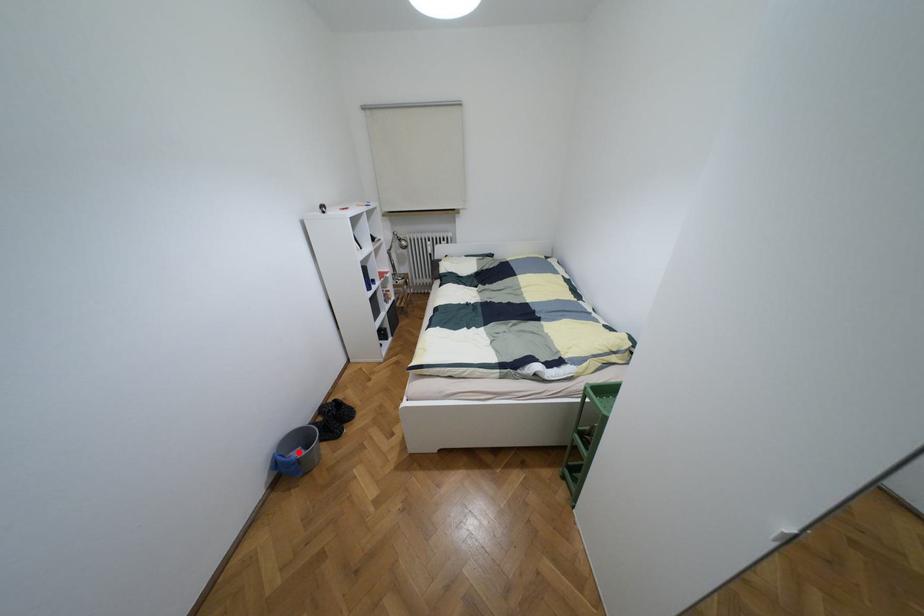
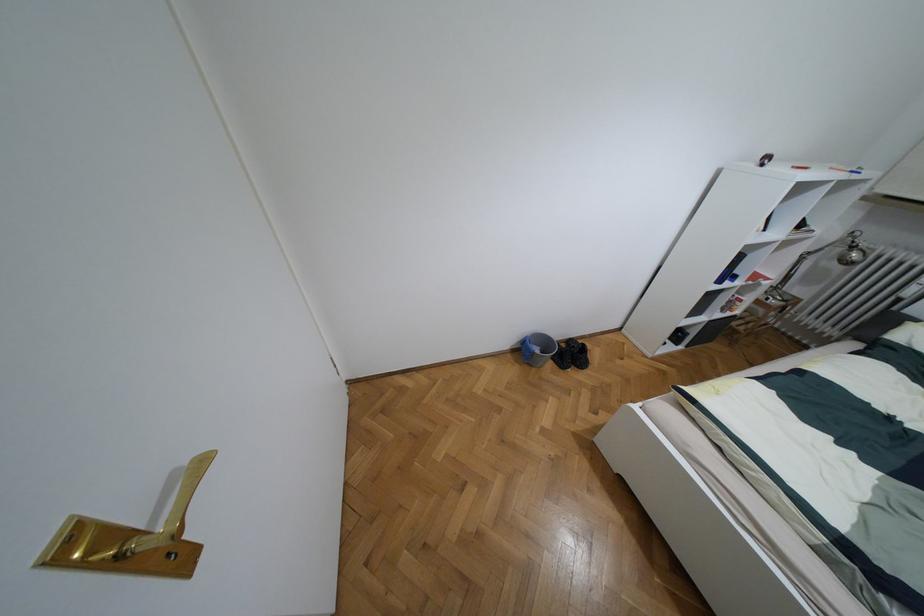
Question: I am providing you with two images of the same scene from different viewpoints. Given a red point in image1, look at the same physical point in image2. Is it:

Choices:
 (A) Closer to the viewpoint
 (B) Farther from the viewpoint

Answer: (B)